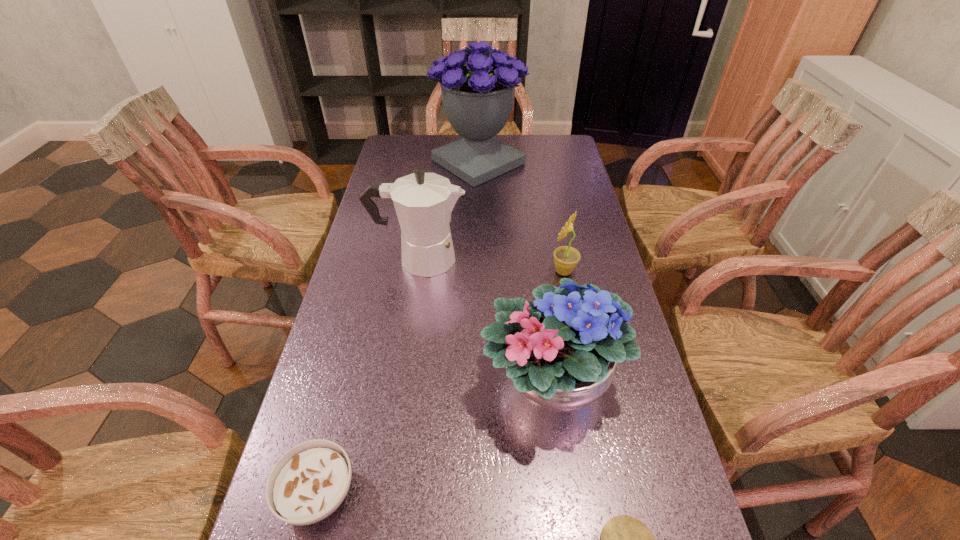
This screenshot has width=960, height=540. Identify the location of the taller bouquet. (478, 83).

Image resolution: width=960 pixels, height=540 pixels. Find the location of `the tallest object`. the tallest object is located at coordinates [x=478, y=83].

I want to click on coffeepot, so click(423, 202).

The image size is (960, 540). Find the location of `the nearer bouquet`. the nearer bouquet is located at coordinates (x=561, y=354).

What are the coordinates of `the fourth shortest object` in the screenshot? It's located at (561, 354).

Find the location of a particular element. the third shortest object is located at coordinates (566, 258).

You are a GUI agent. You are given a task and a screenshot of the screen. Output one action in this format:
    pyautogui.click(x=<x>, y=<y>)
    Task: Click on the shortest object
    
    Given the screenshot: What is the action you would take?
    point(309,482)

The height and width of the screenshot is (540, 960). I want to click on the second nearest object, so click(309, 482).

I want to click on free spot located 0.050m on the back of the taller bouquet, so click(x=478, y=134).

Identify the location of vacant region located 0.380m at the spout of the second tallest object. (599, 259).